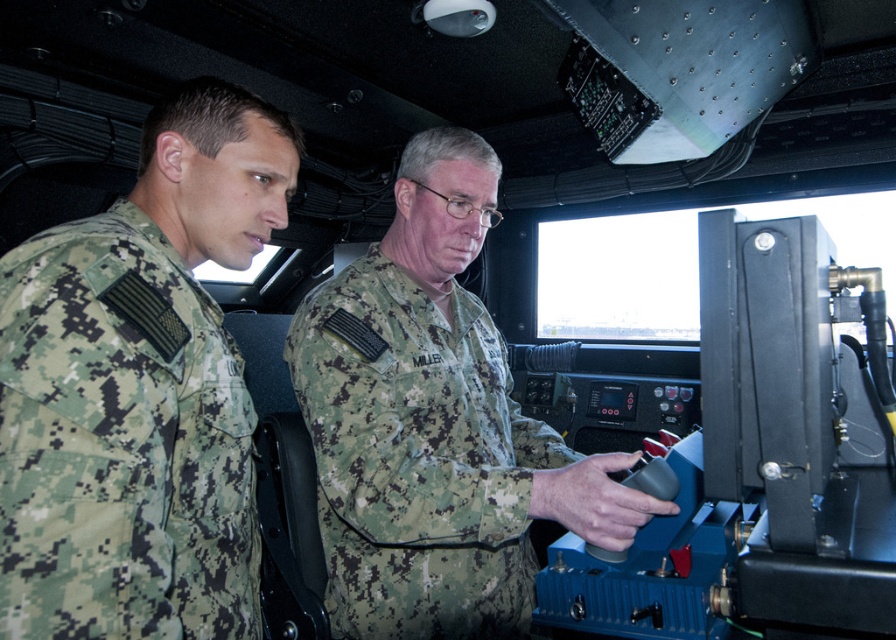
Based on the photo, you are a military inspector checking the uniforms in the control room. The camouflage uniform at left and the camouflage fabric uniform at center must be of the same size according to regulations. Which uniform violates the regulation?

The camouflage uniform at left has a smaller size compared to camouflage fabric uniform at center, so the camouflage uniform at left violates the regulation.

You are a military inspector checking the uniform sizes in the control room. You see the camouflage uniform at left and the camouflage fabric uniform at center. Which uniform has a smaller width?

The camouflage uniform at left has a smaller width than the camouflage fabric uniform at center.